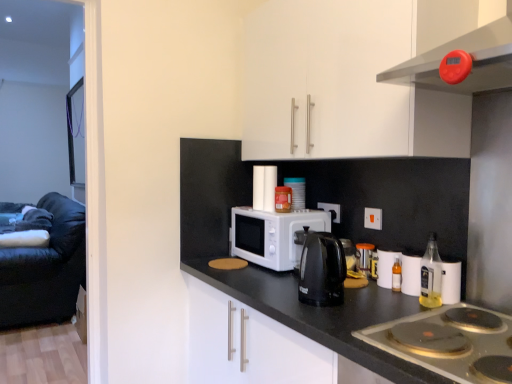
Question: Is point 245,152 closer or farther from the camera than point 434,251?

Choices:
 (A) farther
 (B) closer

Answer: (A)

Question: Is white glossy cabinet at upper center taller or shorter than translucent glass bottle at right?

Choices:
 (A) short
 (B) tall

Answer: (B)

Question: Considering the real-world distances, which object is closest to the orange plastic electric outlet at upper center, which ranks as the 1th electric outlet in right-to-left order?

Choices:
 (A) velvet black couch at left
 (B) black granite countertop at center
 (C) translucent plastic container at center, acting as the first appliance starting from the back
 (D) white matte microwave at center
 (E) white plastic electric outlet at center, positioned as the first electric outlet in left-to-right order

Answer: (E)

Question: Estimate the real-world distances between objects in this image. Which object is closer to the velvet black couch at left?

Choices:
 (A) white glossy cabinet at upper center
 (B) white matte microwave at center
 (C) white plastic electric outlet at center, arranged as the 2th electric outlet when viewed from the right
 (D) silver metallic gas stove at lower right
 (E) black plastic kettle at center

Answer: (B)